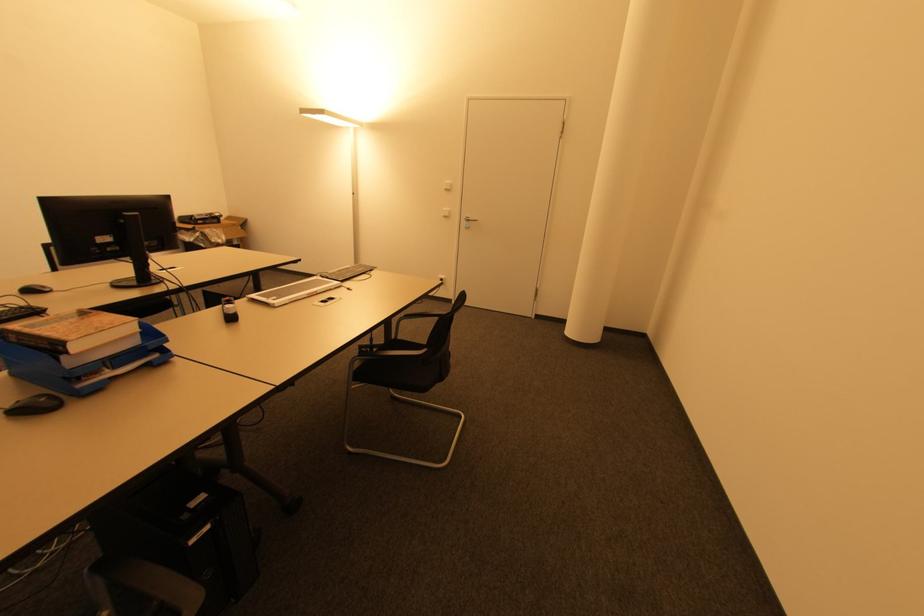
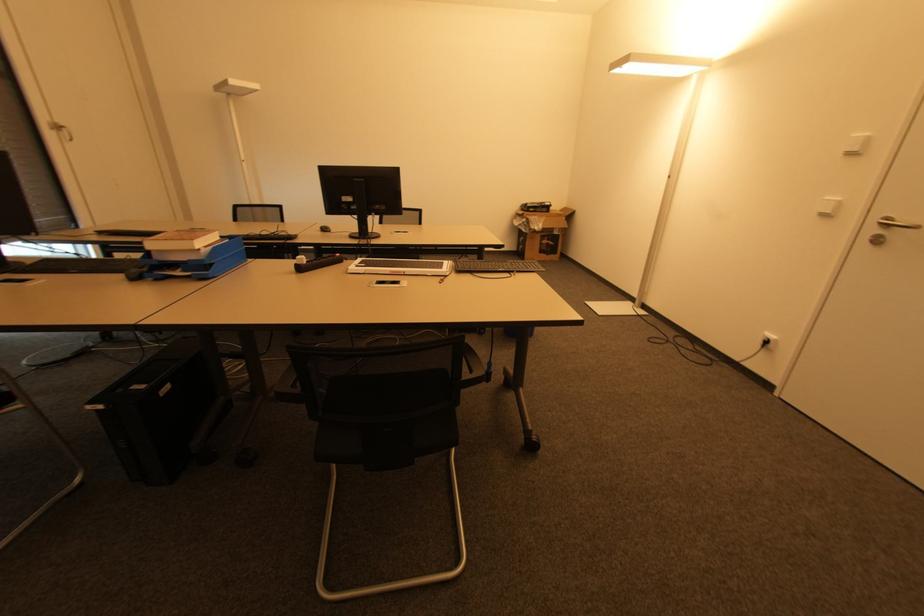
In the second image, find the point that corresponds to [33,292] in the first image.

(325, 230)